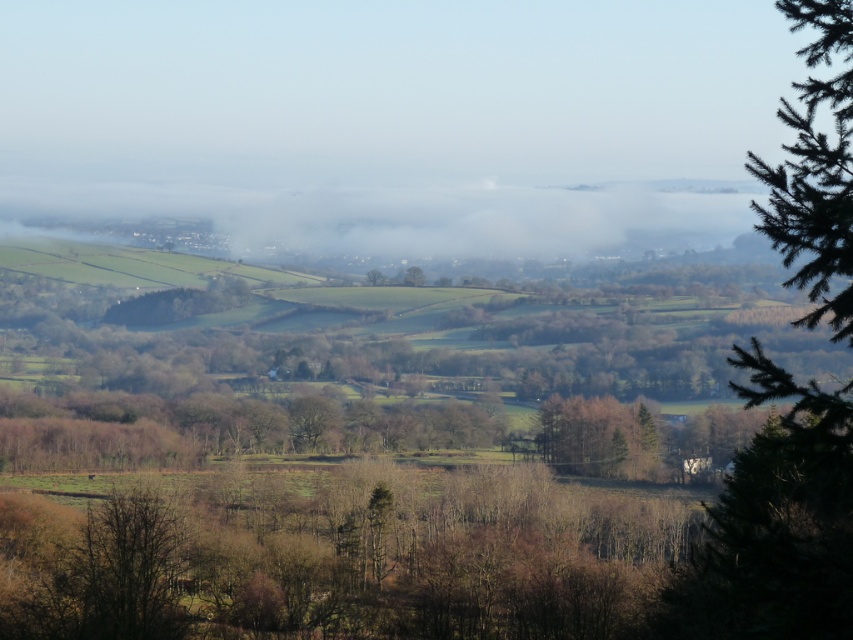
Between green leafy tree at right and green matte tree at center, which one appears on the left side from the viewer's perspective?

Positioned to the left is green matte tree at center.

Can you confirm if green leafy tree at right is wider than green matte tree at center?

Correct, the width of green leafy tree at right exceeds that of green matte tree at center.

Is point (773, 243) behind point (379, 275)?

No.

The width and height of the screenshot is (853, 640). Find the location of `green leafy tree at right`. green leafy tree at right is located at coordinates (776, 522).

Which is in front, point (573, 401) or point (415, 285)?

Point (573, 401) is in front.

Can you confirm if brown matte tree at center is wider than green leafy tree at center?

Yes, brown matte tree at center is wider than green leafy tree at center.

Is point (598, 420) in front of point (422, 276)?

Yes, it is in front of point (422, 276).

At what (x,y) coordinates should I click in order to perform the action: click on brown matte tree at center. Please return your answer as a coordinate pair (x, y). This screenshot has height=640, width=853. Looking at the image, I should click on (598, 436).

The image size is (853, 640). In order to click on green leafy tree at right in this screenshot , I will do `click(776, 522)`.

Is green leafy tree at right smaller than brown matte tree at center?

Incorrect, green leafy tree at right is not smaller in size than brown matte tree at center.

Find the location of a particular element. green leafy tree at right is located at coordinates (776, 522).